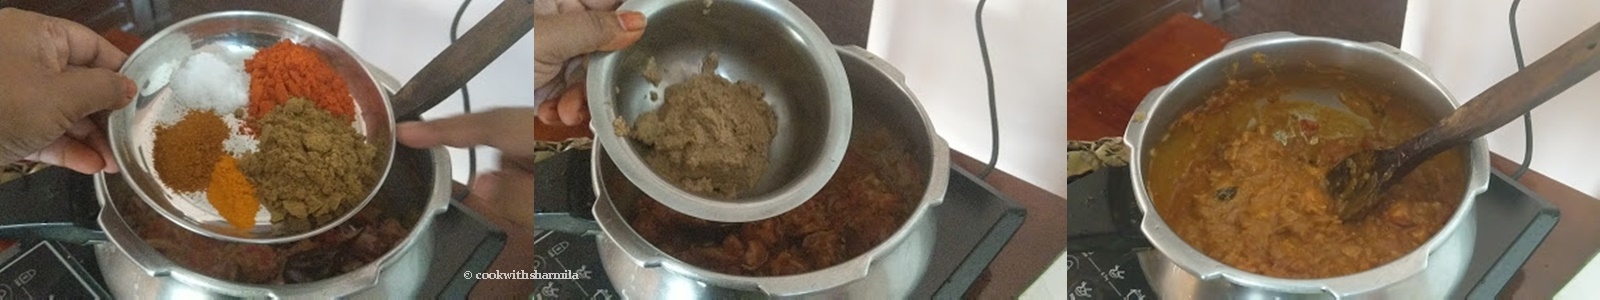
Identify the location of brown table. (1123, 62).